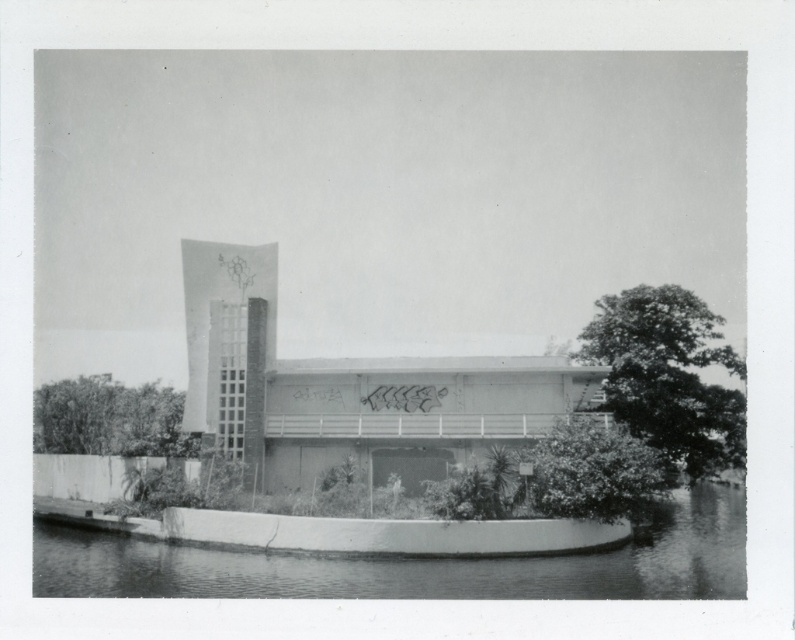
You are standing in front of the modern building. You notice the smooth concrete river at lower center and the dark green leafy tree at right. Which object is shorter in height?

→ The smooth concrete river at lower center is shorter in height compared to the dark green leafy tree at right.

You are standing in front of the modern building and want to walk from the dark green leafy tree at right to the smooth concrete river at lower center. Which direction should you move relative to the tree?

You should move to the left relative to the dark green leafy tree at right because the smooth concrete river at lower center is located to the left of the tree.

You are a drone operator who needs to fly your drone from the smooth concrete river at lower center to the dark green leafy tree at right. Based on the scene, can you determine if the drone will have enough vertical clearance to fly directly between them?

The smooth concrete river at lower center is below the dark green leafy tree at right, so the drone will have enough vertical clearance to fly directly between them.